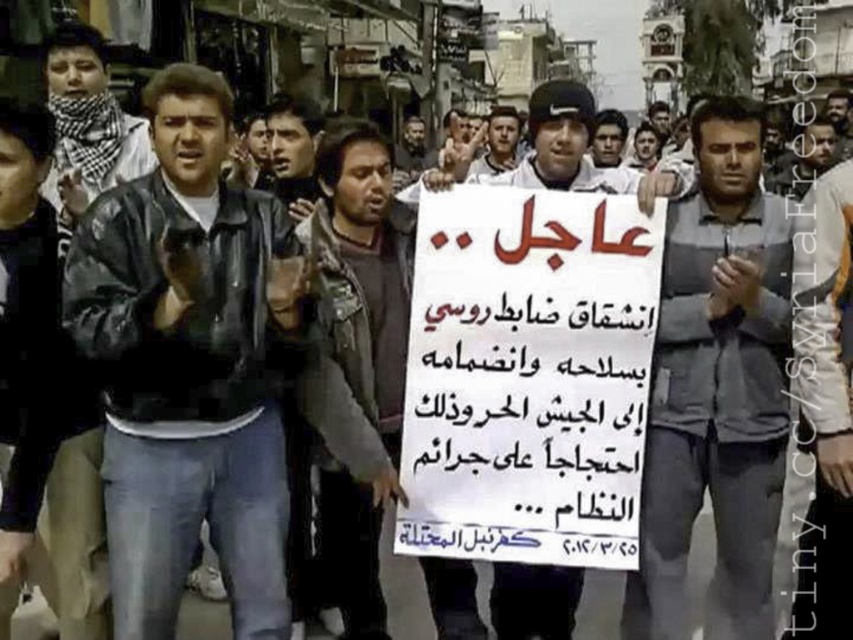
You are a photographer trying to capture a clear image of the gray fabric shirt at center. However, there is a white paper sign at center in the way. Can you adjust your position to avoid the sign and still see the shirt?

The white paper sign at center is in front of gray fabric shirt at center, so you cannot see the gray fabric shirt at center without moving the sign or changing your angle.

You are a photographer trying to capture the protest scene. You notice two participants wearing a black leather jacket at center and a dark gray shirt at center. Which participant should you focus on to get a clearer shot, considering their size in the frame?

The dark gray shirt at center occupies more space in the frame than the black leather jacket at center, so focusing on the participant wearing the dark gray shirt at center would result in a clearer shot due to their larger presence.

You are a photographer at the protest scene. You want to capture a photo that includes both the white paper sign at center and the dark brown leather jacket at center. Based on their positions, which object should you position closer to the left side of your camera frame?

The dark brown leather jacket at center should be positioned closer to the left side of your camera frame because the white paper sign at center is on the right side of it.